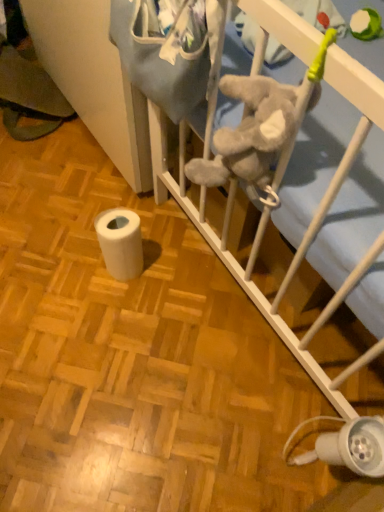
Identify the location of free spot behind white matte toilet paper at lower left. (139, 219).